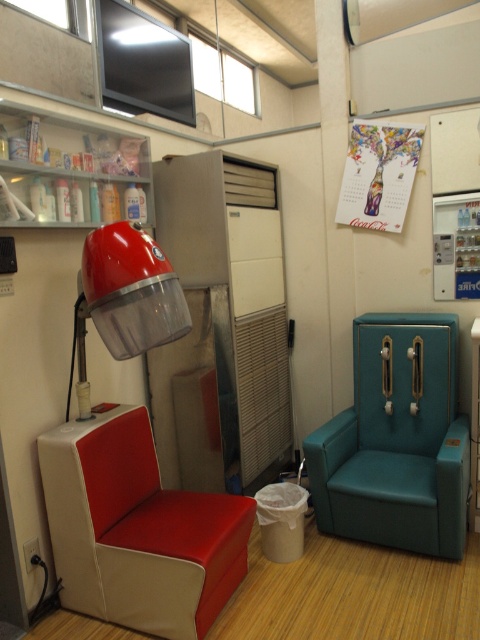
You are a customer in a beauty salon and want to sit on the teal leather chair at right. The stylist is holding a 3.5 feet long tool. If they want to hand it to you without moving, can they reach you from the matte red hairdryer at left?

The teal leather chair at right is 4.11 feet away from the matte red hairdryer at left. Since the tool is 3.5 feet long, the stylist cannot reach you from the matte red hairdryer at left without moving closer.

You are a photographer taking a picture of the room. You want to focus on both point (62, 474) and point (112, 228). Which point is closer to the camera?

Point (112, 228) is closer to the camera than point (62, 474).

You are standing in the room and want to reach a point that is exactly 7.50 feet away from you. Can you confirm if the point at coordinates point (46, 470) is that location?

Yes, the point at coordinates point (46, 470) is exactly 7.50 feet away from you, so you can reach that location.